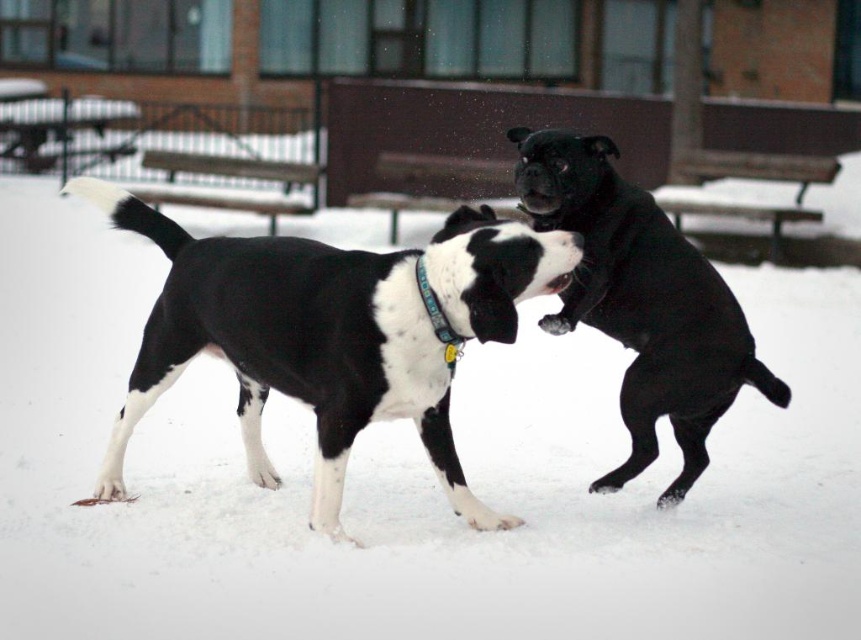
You are a photographer trying to capture a closeup shot of the black glossy dog at center and the teal fabric neckband at center. Given that the camera can only focus on one object at a time, which object should you focus on first if you want to ensure the bigger object is in focus?

The black glossy dog at center is bigger than the teal fabric neckband at center, so you should focus on the black glossy dog at center first to ensure the bigger object is in focus.

You are a photographer trying to capture a photo of the black and white fur dog at center. According to the coordinates provided, where should you aim your camera to ensure the dog is centered in the frame?

The black and white fur dog at center is located at point (330, 332), so you should aim your camera at those coordinates to center it in the frame.